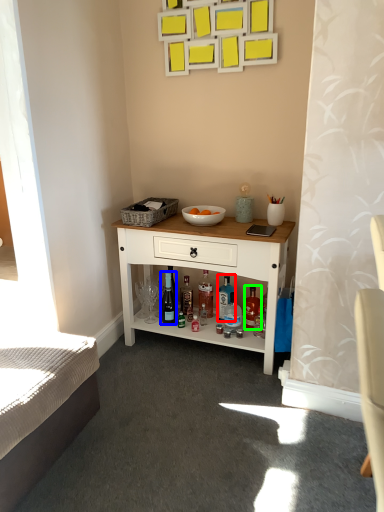
Question: Considering the real-world distances, which object is farthest from bottle (highlighted by a red box)? wine bottle (highlighted by a blue box) or bottle (highlighted by a green box)?

Choices:
 (A) wine bottle
 (B) bottle

Answer: (A)